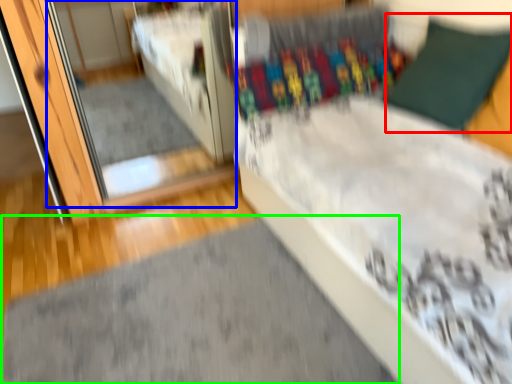
Question: Which object is positioned closest to pillow (highlighted by a red box)? Select from mirror (highlighted by a blue box) and doormat (highlighted by a green box).

Choices:
 (A) mirror
 (B) doormat

Answer: (B)